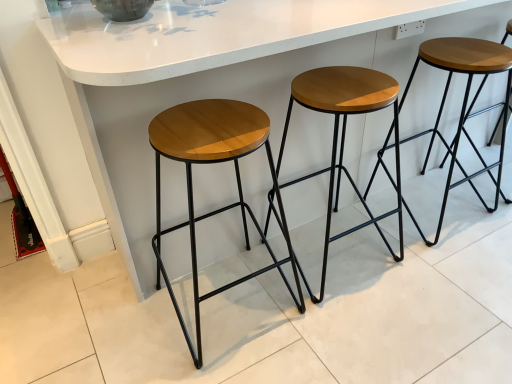
This screenshot has width=512, height=384. What do you see at coordinates (463, 107) in the screenshot? I see `wooden seat at center, arranged as the 1th stool when viewed from the right` at bounding box center [463, 107].

You are a GUI agent. You are given a task and a screenshot of the screen. Output one action in this format:
    pyautogui.click(x=<x>, y=<y>)
    Task: Click on the wooden/matte stool at center, marked as the 2th stool in a left-to-right arrangement
    
    Given the screenshot: What is the action you would take?
    pyautogui.click(x=344, y=137)

Find the location of a particular element. The image size is (512, 384). wooden seat at center, acting as the 3th stool starting from the left is located at coordinates (463, 107).

Is point (254, 178) positioned in front of point (410, 85)?

Yes, point (254, 178) is in front of point (410, 85).

From the image's perspective, relative to wooden seat at center, arranged as the 1th stool when viewed from the right, is white glossy counter at center above or below?

white glossy counter at center is above wooden seat at center, arranged as the 1th stool when viewed from the right.

Is white glossy counter at center smaller than wooden seat at center, arranged as the 1th stool when viewed from the right?

No, white glossy counter at center is not smaller than wooden seat at center, arranged as the 1th stool when viewed from the right.

This screenshot has width=512, height=384. There is a white glossy counter at center. In order to click on the 3rd stool below it (from the image's perspective) in this screenshot , I will do `click(209, 163)`.

Does white glossy counter at center turn towards wooden/matte stool at center, the third stool from the right?

Yes, white glossy counter at center faces towards wooden/matte stool at center, the third stool from the right.

In the image, is white glossy counter at center on the left side or the right side of wooden/matte stool at center, placed as the first stool when sorted from left to right?

Based on their positions, white glossy counter at center is located to the right of wooden/matte stool at center, placed as the first stool when sorted from left to right.

From the image's perspective, relative to wooden/matte stool at center, placed as the first stool when sorted from left to right, is white glossy counter at center above or below?

Clearly, from the image's perspective, white glossy counter at center is above wooden/matte stool at center, placed as the first stool when sorted from left to right.

Identify the location of the 1st stool in front of the wooden seat at center, acting as the 3th stool starting from the left. This screenshot has height=384, width=512. (344, 137).

Which of these two, wooden/matte stool at center, marked as the 2th stool in a left-to-right arrangement, or wooden seat at center, acting as the 3th stool starting from the left, is bigger?

With larger size is wooden seat at center, acting as the 3th stool starting from the left.

Is wooden/matte stool at center, acting as the second stool starting from the right, not close to wooden seat at center, acting as the 3th stool starting from the left?

They are positioned close to each other.

Is wooden/matte stool at center, marked as the 2th stool in a left-to-right arrangement, in front of or behind wooden seat at center, acting as the 3th stool starting from the left, in the image?

wooden/matte stool at center, marked as the 2th stool in a left-to-right arrangement, is in front of wooden seat at center, acting as the 3th stool starting from the left.

Is wooden seat at center, acting as the 3th stool starting from the left, smaller than wooden/matte stool at center, acting as the second stool starting from the right?

No.

Can you confirm if wooden seat at center, arranged as the 1th stool when viewed from the right, is positioned to the left of wooden/matte stool at center, marked as the 2th stool in a left-to-right arrangement?

Incorrect, wooden seat at center, arranged as the 1th stool when viewed from the right, is not on the left side of wooden/matte stool at center, marked as the 2th stool in a left-to-right arrangement.

Is wooden seat at center, acting as the 3th stool starting from the left, positioned beyond the bounds of wooden/matte stool at center, acting as the second stool starting from the right?

That's correct, wooden seat at center, acting as the 3th stool starting from the left, is outside of wooden/matte stool at center, acting as the second stool starting from the right.

Is wooden seat at center, arranged as the 1th stool when viewed from the right, in front of or behind wooden/matte stool at center, acting as the second stool starting from the right, in the image?

wooden seat at center, arranged as the 1th stool when viewed from the right, is behind wooden/matte stool at center, acting as the second stool starting from the right.

Is point (445, 41) closer or farther from the camera than point (278, 269)?

Point (445, 41) is closer to the camera than point (278, 269).

Is wooden seat at center, acting as the 3th stool starting from the left, positioned in front of wooden/matte stool at center, placed as the first stool when sorted from left to right?

That is False.

Is wooden seat at center, acting as the 3th stool starting from the left, wider than wooden/matte stool at center, placed as the first stool when sorted from left to right?

Indeed, wooden seat at center, acting as the 3th stool starting from the left, has a greater width compared to wooden/matte stool at center, placed as the first stool when sorted from left to right.

From the image's perspective, which one is positioned higher, wooden seat at center, arranged as the 1th stool when viewed from the right, or wooden/matte stool at center, placed as the first stool when sorted from left to right?

wooden seat at center, arranged as the 1th stool when viewed from the right, appears higher in the image.

Between wooden/matte stool at center, the third stool from the right, and wooden/matte stool at center, acting as the second stool starting from the right, which one is positioned in front?

wooden/matte stool at center, the third stool from the right, is more forward.

Which is more to the left, wooden/matte stool at center, placed as the first stool when sorted from left to right, or wooden/matte stool at center, marked as the 2th stool in a left-to-right arrangement?

wooden/matte stool at center, placed as the first stool when sorted from left to right.

Which is nearer, (170, 111) or (399, 151)?

Point (170, 111)

Between wooden/matte stool at center, placed as the first stool when sorted from left to right, and wooden/matte stool at center, acting as the second stool starting from the right, which one has smaller size?

wooden/matte stool at center, acting as the second stool starting from the right.

Would you consider wooden/matte stool at center, placed as the first stool when sorted from left to right, to be distant from white glossy counter at center?

No, there isn't a large distance between wooden/matte stool at center, placed as the first stool when sorted from left to right, and white glossy counter at center.

Can you tell me how much wooden/matte stool at center, the third stool from the right, and white glossy counter at center differ in facing direction?

180 degrees separate the facing orientations of wooden/matte stool at center, the third stool from the right, and white glossy counter at center.

Which object is further away from the camera, wooden/matte stool at center, placed as the first stool when sorted from left to right, or white glossy counter at center?

wooden/matte stool at center, placed as the first stool when sorted from left to right, is behind.

Identify the location of the 3rd stool directly beneath the white glossy counter at center (from a real-world perspective). The width and height of the screenshot is (512, 384). (463, 107).

From the image's perspective, which stool is the 3rd one below the white glossy counter at center? Please provide its 2D coordinates.

[(209, 163)]

When comparing their distances from wooden/matte stool at center, acting as the second stool starting from the right, does white glossy counter at center or wooden/matte stool at center, the third stool from the right, seem further?

wooden/matte stool at center, the third stool from the right.

Based on their spatial positions, is wooden/matte stool at center, acting as the second stool starting from the right, or white glossy counter at center closer to wooden seat at center, acting as the 3th stool starting from the left?

wooden/matte stool at center, acting as the second stool starting from the right, is positioned closer to the anchor wooden seat at center, acting as the 3th stool starting from the left.

Based on their spatial positions, is wooden seat at center, arranged as the 1th stool when viewed from the right, or wooden/matte stool at center, acting as the second stool starting from the right, further from wooden/matte stool at center, placed as the first stool when sorted from left to right?

The object further to wooden/matte stool at center, placed as the first stool when sorted from left to right, is wooden seat at center, arranged as the 1th stool when viewed from the right.

When comparing their distances from wooden/matte stool at center, acting as the second stool starting from the right, does white glossy counter at center or wooden seat at center, acting as the 3th stool starting from the left, seem further?

Among the two, wooden seat at center, acting as the 3th stool starting from the left, is located further to wooden/matte stool at center, acting as the second stool starting from the right.

Estimate the real-world distances between objects in this image. Which object is closer to wooden seat at center, acting as the 3th stool starting from the left, wooden/matte stool at center, marked as the 2th stool in a left-to-right arrangement, or wooden/matte stool at center, the third stool from the right?

wooden/matte stool at center, marked as the 2th stool in a left-to-right arrangement, is positioned closer to the anchor wooden seat at center, acting as the 3th stool starting from the left.

Considering their positions, is wooden seat at center, arranged as the 1th stool when viewed from the right, positioned closer to wooden/matte stool at center, placed as the first stool when sorted from left to right, than white glossy counter at center?

Based on the image, white glossy counter at center appears to be nearer to wooden/matte stool at center, placed as the first stool when sorted from left to right.

Based on their spatial positions, is wooden/matte stool at center, the third stool from the right, or wooden/matte stool at center, marked as the 2th stool in a left-to-right arrangement, further from white glossy counter at center?

wooden/matte stool at center, the third stool from the right, is positioned further to the anchor white glossy counter at center.

Looking at the image, which one is located closer to wooden/matte stool at center, the third stool from the right, white glossy counter at center or wooden seat at center, acting as the 3th stool starting from the left?

white glossy counter at center is positioned closer to the anchor wooden/matte stool at center, the third stool from the right.

What are the coordinates of `stool between white glossy counter at center and wooden/matte stool at center, marked as the 2th stool in a left-to-right arrangement, vertically` in the screenshot? It's located at (463, 107).

This screenshot has height=384, width=512. I want to click on stool between wooden/matte stool at center, placed as the first stool when sorted from left to right, and wooden seat at center, arranged as the 1th stool when viewed from the right, in the horizontal direction, so [x=344, y=137].